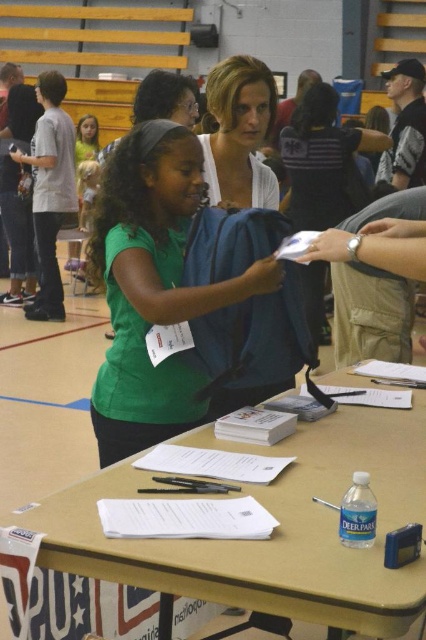
You are an event organizer checking the layout of the registration table. You notice two attendees wearing the green matte shirt at center and the matte white blouse at center. Which attendee has a wider clothing item in terms of the shirt or blouse width?

The green matte shirt at center has a greater width than the matte white blouse at center, so the attendee wearing the green matte shirt at center has the wider clothing item.

You are organizing a small event and need to place a 1.5 meter long banner on the matte plastic table at center. Can the banner fit on the table if the matte white blouse at center is currently occupying part of its surface?

The matte plastic table at center might be wider than matte white blouse at center, so the banner could potentially fit if the blouse is moved aside. However, the exact dimensions aren

You are a photographer at the gymnasium event and need to capture a clear shot of both the green matte shirt at center and the matte white blouse at center. Based on their positions, which one is lower in the frame?

The green matte shirt at center is positioned under the matte white blouse at center, so it is lower in the frame.